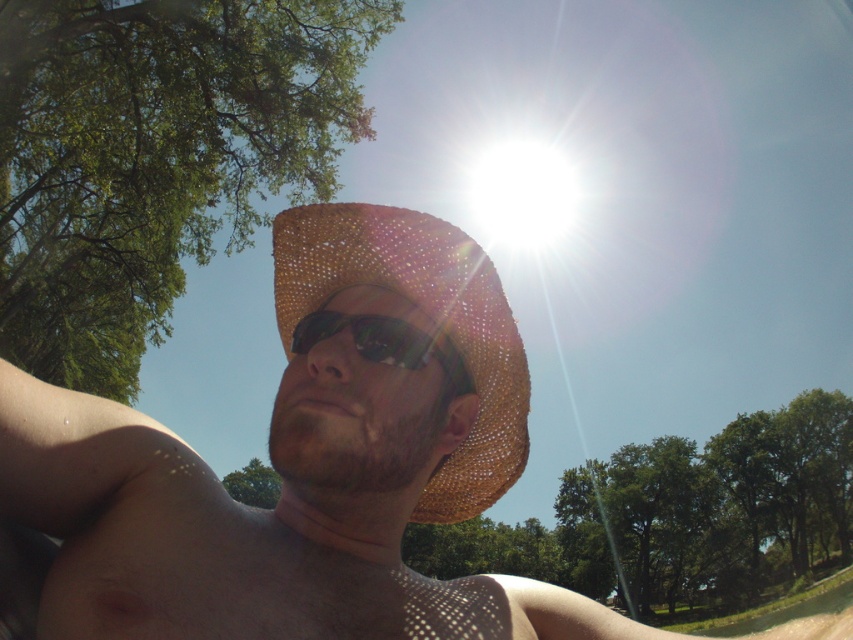
Does braided straw cowboy hat at center have a larger size compared to sunglasses at center?

Indeed, braided straw cowboy hat at center has a larger size compared to sunglasses at center.

Between braided straw cowboy hat at center and sunglasses at center, which one has less height?

With less height is sunglasses at center.

Measure the distance between point [473,461] and camera.

Point [473,461] is 37.54 inches away from camera.

Image resolution: width=853 pixels, height=640 pixels. I want to click on braided straw cowboy hat at center, so click(427, 317).

What are the coordinates of `brown straw hat at center` in the screenshot? It's located at [293, 472].

Can you confirm if brown straw hat at center is positioned to the right of sunglasses at center?

Indeed, brown straw hat at center is positioned on the right side of sunglasses at center.

Which is in front, point (154, 492) or point (315, 314)?

Point (154, 492)

Where is `brown straw hat at center`? This screenshot has width=853, height=640. brown straw hat at center is located at coordinates (293, 472).

Is brown straw hat at center bigger than braided straw cowboy hat at center?

Yes, brown straw hat at center is bigger than braided straw cowboy hat at center.

Can you confirm if brown straw hat at center is positioned below braided straw cowboy hat at center?

Correct, brown straw hat at center is located below braided straw cowboy hat at center.

Does point (540, 592) come farther from viewer compared to point (305, 291)?

No, it is in front of (305, 291).

You are a GUI agent. You are given a task and a screenshot of the screen. Output one action in this format:
    pyautogui.click(x=<x>, y=<y>)
    Task: Click on the brown straw hat at center
    
    Given the screenshot: What is the action you would take?
    pyautogui.click(x=293, y=472)